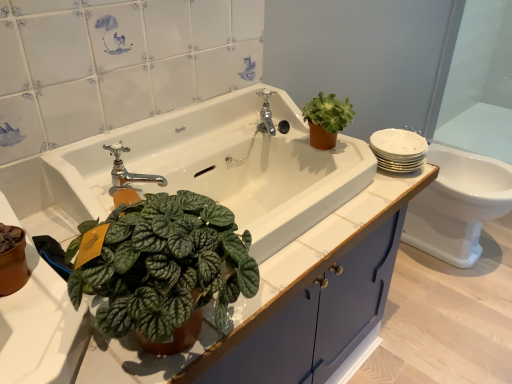
Question: Does white glossy toilet at right appear on the left side of blue matte cabinet at center?

Choices:
 (A) no
 (B) yes

Answer: (A)

Question: Would you say white glossy toilet at right is outside blue matte cabinet at center?

Choices:
 (A) yes
 (B) no

Answer: (A)

Question: Is white glossy toilet at right positioned before blue matte cabinet at center?

Choices:
 (A) yes
 (B) no

Answer: (B)

Question: Is white glossy toilet at right facing away from blue matte cabinet at center?

Choices:
 (A) yes
 (B) no

Answer: (B)

Question: From the image's perspective, is white glossy toilet at right located beneath blue matte cabinet at center?

Choices:
 (A) no
 (B) yes

Answer: (A)

Question: Is white glossy toilet at right behind blue matte cabinet at center?

Choices:
 (A) no
 (B) yes

Answer: (B)

Question: Is blue matte cabinet at center closer to the viewer compared to white glossy sink at center?

Choices:
 (A) no
 (B) yes

Answer: (B)

Question: From the image's perspective, is blue matte cabinet at center over white glossy sink at center?

Choices:
 (A) no
 (B) yes

Answer: (A)

Question: Does blue matte cabinet at center have a lesser height compared to white glossy sink at center?

Choices:
 (A) no
 (B) yes

Answer: (A)

Question: Are blue matte cabinet at center and white glossy sink at center beside each other?

Choices:
 (A) yes
 (B) no

Answer: (B)

Question: Does blue matte cabinet at center have a greater height compared to white glossy sink at center?

Choices:
 (A) yes
 (B) no

Answer: (A)

Question: Considering the relative sizes of blue matte cabinet at center and white glossy sink at center in the image provided, is blue matte cabinet at center wider than white glossy sink at center?

Choices:
 (A) yes
 (B) no

Answer: (A)

Question: Is polished chrome faucet at center, acting as the second tap starting from the right, oriented towards blue matte cabinet at center?

Choices:
 (A) no
 (B) yes

Answer: (A)